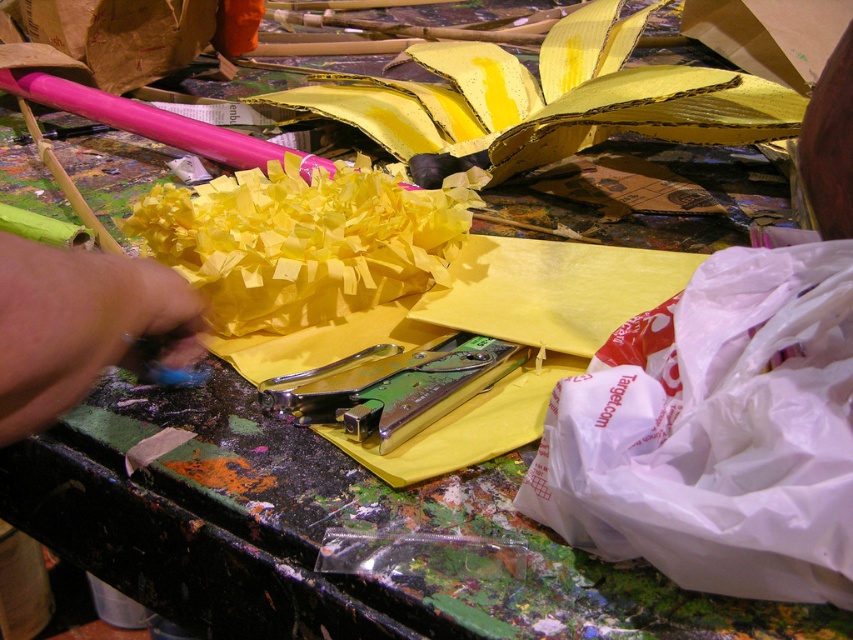
Question: Observing the image, what is the correct spatial positioning of white plastic bag at lower right in reference to blue fabric hand at lower left?

Choices:
 (A) above
 (B) below

Answer: (B)

Question: Does white plastic bag at lower right have a smaller size compared to metallic green stapler at center?

Choices:
 (A) yes
 (B) no

Answer: (B)

Question: Can you confirm if white plastic bag at lower right is positioned below metallic green stapler at center?

Choices:
 (A) no
 (B) yes

Answer: (B)

Question: Which is farther from the metallic green stapler at center?

Choices:
 (A) blue fabric hand at lower left
 (B) white plastic bag at lower right

Answer: (A)

Question: Which of the following is the closest to the observer?

Choices:
 (A) (186, 289)
 (B) (548, 432)

Answer: (A)

Question: Which of the following is the farthest from the observer?

Choices:
 (A) blue fabric hand at lower left
 (B) metallic green stapler at center

Answer: (B)